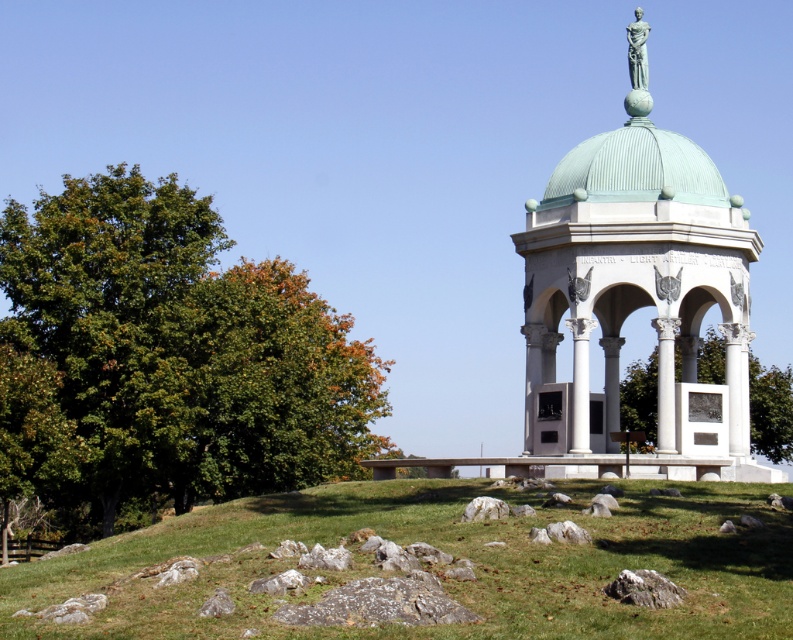
Can you confirm if green leafy tree at left is positioned above green leafy tree at center?

Correct, green leafy tree at left is located above green leafy tree at center.

Is green leafy tree at left wider than green leafy tree at center?

Indeed, green leafy tree at left has a greater width compared to green leafy tree at center.

You are a GUI agent. You are given a task and a screenshot of the screen. Output one action in this format:
    pyautogui.click(x=<x>, y=<y>)
    Task: Click on the green leafy tree at left
    Image resolution: width=793 pixels, height=640 pixels.
    Given the screenshot: What is the action you would take?
    pyautogui.click(x=167, y=358)

Locate an element on the screen. The width and height of the screenshot is (793, 640). green leafy tree at left is located at coordinates (167, 358).

Between green grass at lower center and green leafy tree at center, which one is positioned lower?

green grass at lower center is lower down.

Can you confirm if green grass at lower center is positioned above green leafy tree at center?

No, green grass at lower center is not above green leafy tree at center.

Does point (0, 600) come farther from viewer compared to point (630, 417)?

No.

Identify the location of green grass at lower center. The height and width of the screenshot is (640, 793). (439, 577).

Is green leafy tree at left below green marble gazebo at center?

Correct, green leafy tree at left is located below green marble gazebo at center.

Between green leafy tree at left and green marble gazebo at center, which one has less height?

With less height is green marble gazebo at center.

Is point (282, 419) closer to viewer compared to point (531, 419)?

No, it is not.

Where is `green leafy tree at left`? green leafy tree at left is located at coordinates (167, 358).